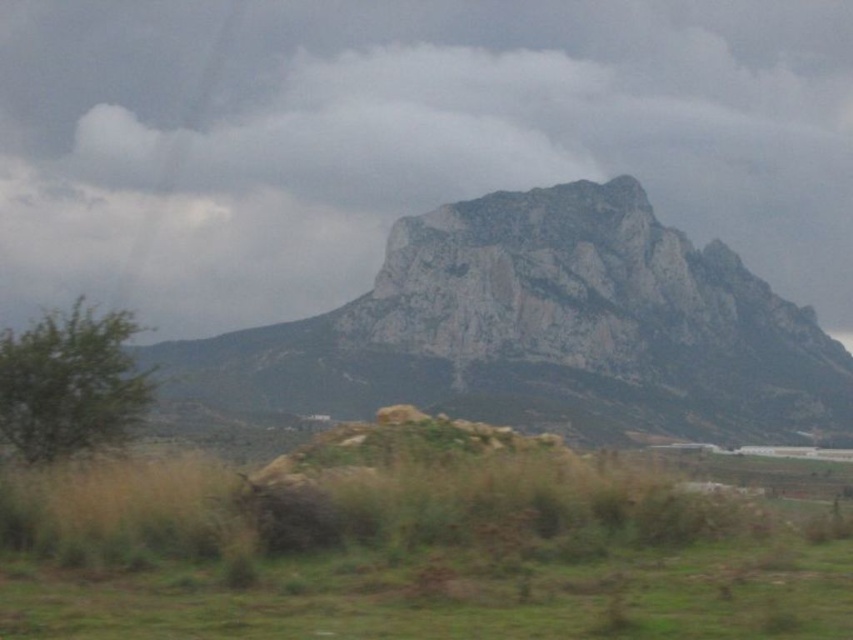
Is point (244, 216) farther from viewer compared to point (619, 518)?

Yes, point (244, 216) is farther from viewer.

Can you confirm if white cloudy sky at upper center is thinner than green grass at lower center?

In fact, white cloudy sky at upper center might be wider than green grass at lower center.

Is point (173, 131) farther from camera compared to point (688, 529)?

Yes.

Locate an element on the screen. white cloudy sky at upper center is located at coordinates (401, 140).

Is white cloudy sky at upper center thinner than granite rock formation at center?

No.

Does white cloudy sky at upper center have a larger size compared to granite rock formation at center?

Correct, white cloudy sky at upper center is larger in size than granite rock formation at center.

What do you see at coordinates (401, 140) in the screenshot? The height and width of the screenshot is (640, 853). I see `white cloudy sky at upper center` at bounding box center [401, 140].

Identify the location of white cloudy sky at upper center. The height and width of the screenshot is (640, 853). (401, 140).

Is point (643, 547) in front of point (689, 360)?

Yes, point (643, 547) is closer to viewer.

Does green grass at lower center come in front of granite rock formation at center?

Yes.

The image size is (853, 640). What are the coordinates of `green grass at lower center` in the screenshot? It's located at (410, 556).